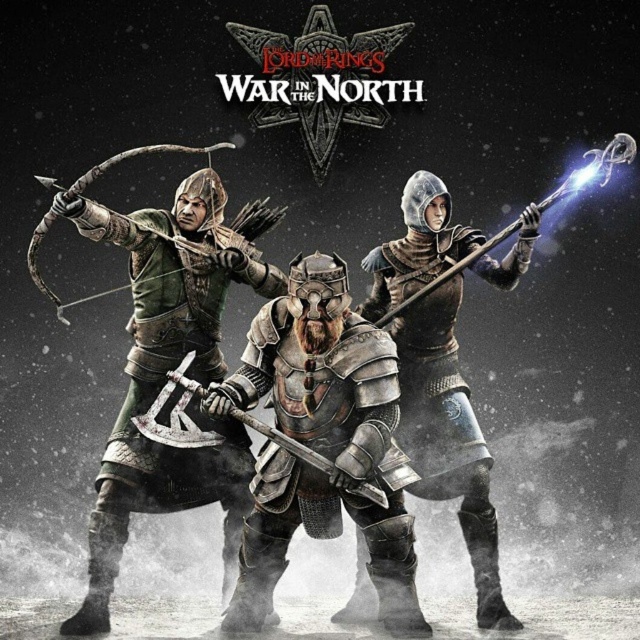
From the picture: Where is the polished silver armor at center located in the image?

The polished silver armor at center is located at point (321,442) in the image.